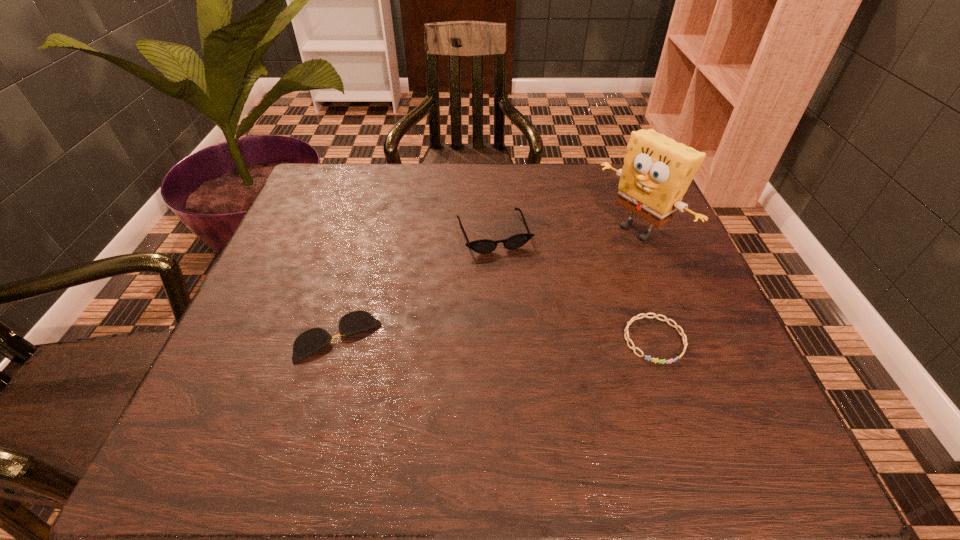
Locate an element on the screen. The height and width of the screenshot is (540, 960). sponge that is at the right edge is located at coordinates (657, 171).

The image size is (960, 540). I want to click on object that is at the near left corner, so click(314, 339).

The height and width of the screenshot is (540, 960). I want to click on object that is at the far right corner, so click(657, 171).

Identify the location of object located at the near right corner. This screenshot has height=540, width=960. (676, 326).

This screenshot has height=540, width=960. I want to click on vacant space at the far edge of the desktop, so click(430, 163).

Where is `free space at the near edge of the desktop`? The height and width of the screenshot is (540, 960). free space at the near edge of the desktop is located at coordinates (628, 388).

In the image, there is a desktop. Where is `vacant region at the left edge`? The image size is (960, 540). vacant region at the left edge is located at coordinates (x=278, y=329).

Image resolution: width=960 pixels, height=540 pixels. Find the location of `vacant space at the right edge of the desktop`. vacant space at the right edge of the desktop is located at coordinates (658, 345).

The height and width of the screenshot is (540, 960). Find the location of `free region at the far left corner of the desktop`. free region at the far left corner of the desktop is located at coordinates (312, 200).

Identify the location of vacant point at the near left corner. The image size is (960, 540). (276, 408).